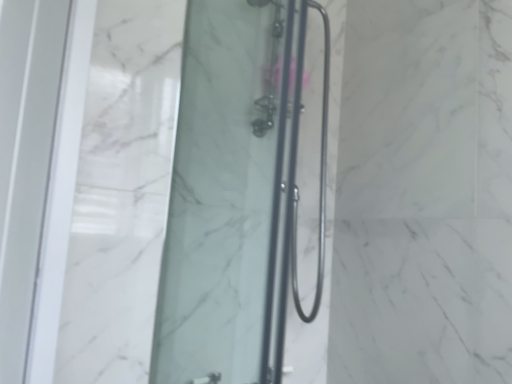
In the scene shown: How much space does transparent glass shower door at center, positioned as the second shower door in back-to-front order, occupy vertically?

transparent glass shower door at center, positioned as the second shower door in back-to-front order, is 3.73 feet in height.

Find the location of a particular element. The height and width of the screenshot is (384, 512). transparent glass shower door at center, the first shower door viewed from the front is located at coordinates (236, 194).

Describe the element at coordinates (236, 194) in the screenshot. This screenshot has width=512, height=384. I see `transparent glass shower door at center, which appears as the 2th shower door when viewed from the right` at that location.

What do you see at coordinates (320, 186) in the screenshot?
I see `black metal shower door at center, the 1th shower door when ordered from right to left` at bounding box center [320, 186].

In order to click on black metal shower door at center, the 2th shower door when ordered from front to back in this screenshot , I will do `click(320, 186)`.

This screenshot has width=512, height=384. What are the coordinates of `transparent glass shower door at center, positioned as the second shower door in back-to-front order` in the screenshot? It's located at (236, 194).

Considering the relative positions of black metal shower door at center, the first shower door when ordered from back to front, and transparent glass shower door at center, positioned as the second shower door in back-to-front order, in the image provided, is black metal shower door at center, the first shower door when ordered from back to front, to the left of transparent glass shower door at center, positioned as the second shower door in back-to-front order, from the viewer's perspective?

In fact, black metal shower door at center, the first shower door when ordered from back to front, is to the right of transparent glass shower door at center, positioned as the second shower door in back-to-front order.

Which object is more forward, black metal shower door at center, the 2th shower door positioned from the left, or transparent glass shower door at center, which is counted as the first shower door, starting from the left?

Positioned in front is transparent glass shower door at center, which is counted as the first shower door, starting from the left.

Considering the points (318, 243) and (233, 352), which point is in front, point (318, 243) or point (233, 352)?

The point (233, 352) is closer.

From the image's perspective, relative to transparent glass shower door at center, the first shower door viewed from the front, is black metal shower door at center, the 2th shower door positioned from the left, above or below?

Clearly, from the image's perspective, black metal shower door at center, the 2th shower door positioned from the left, is above transparent glass shower door at center, the first shower door viewed from the front.

From a real-world perspective, which is physically below, black metal shower door at center, the 2th shower door when ordered from front to back, or transparent glass shower door at center, positioned as the second shower door in back-to-front order?

In real-world perspective, transparent glass shower door at center, positioned as the second shower door in back-to-front order, is lower.

Can you confirm if black metal shower door at center, the first shower door when ordered from back to front, is wider than transparent glass shower door at center, which is counted as the first shower door, starting from the left?

Yes.

Between black metal shower door at center, the first shower door when ordered from back to front, and transparent glass shower door at center, which appears as the 2th shower door when viewed from the right, which one has more height?

transparent glass shower door at center, which appears as the 2th shower door when viewed from the right.

Between black metal shower door at center, the 2th shower door positioned from the left, and transparent glass shower door at center, positioned as the second shower door in back-to-front order, which one has smaller size?

black metal shower door at center, the 2th shower door positioned from the left, is smaller.

Is black metal shower door at center, the 1th shower door when ordered from right to left, outside of transparent glass shower door at center, the first shower door viewed from the front?

black metal shower door at center, the 1th shower door when ordered from right to left, lies outside transparent glass shower door at center, the first shower door viewed from the front,'s area.

Is black metal shower door at center, the 2th shower door positioned from the left, in contact with transparent glass shower door at center, which is counted as the first shower door, starting from the left?

There is a gap between black metal shower door at center, the 2th shower door positioned from the left, and transparent glass shower door at center, which is counted as the first shower door, starting from the left.

Is black metal shower door at center, the 2th shower door when ordered from front to back, facing away from transparent glass shower door at center, which is counted as the first shower door, starting from the left?

No, black metal shower door at center, the 2th shower door when ordered from front to back, is not facing the opposite direction of transparent glass shower door at center, which is counted as the first shower door, starting from the left.

This screenshot has height=384, width=512. I want to click on shower door on the right of transparent glass shower door at center, which is counted as the first shower door, starting from the left, so click(x=320, y=186).

Can you confirm if transparent glass shower door at center, the first shower door viewed from the front, is positioned to the left of black metal shower door at center, the 1th shower door when ordered from right to left?

Yes, transparent glass shower door at center, the first shower door viewed from the front, is to the left of black metal shower door at center, the 1th shower door when ordered from right to left.

Who is more distant, transparent glass shower door at center, positioned as the second shower door in back-to-front order, or black metal shower door at center, the 2th shower door when ordered from front to back?

black metal shower door at center, the 2th shower door when ordered from front to back, is more distant.

Is point (186, 277) closer or farther from the camera than point (325, 144)?

Clearly, point (186, 277) is closer to the camera than point (325, 144).

From the image's perspective, is transparent glass shower door at center, the first shower door viewed from the front, positioned above or below black metal shower door at center, the 1th shower door when ordered from right to left?

Clearly, from the image's perspective, transparent glass shower door at center, the first shower door viewed from the front, is below black metal shower door at center, the 1th shower door when ordered from right to left.

From the picture: From a real-world perspective, is transparent glass shower door at center, positioned as the second shower door in back-to-front order, located beneath black metal shower door at center, the first shower door when ordered from back to front?

Yes, from a real-world perspective, transparent glass shower door at center, positioned as the second shower door in back-to-front order, is below black metal shower door at center, the first shower door when ordered from back to front.

Considering the sizes of objects transparent glass shower door at center, which appears as the 2th shower door when viewed from the right, and black metal shower door at center, the 1th shower door when ordered from right to left, in the image provided, who is wider, transparent glass shower door at center, which appears as the 2th shower door when viewed from the right, or black metal shower door at center, the 1th shower door when ordered from right to left,?

With larger width is black metal shower door at center, the 1th shower door when ordered from right to left.

Considering the sizes of objects transparent glass shower door at center, the first shower door viewed from the front, and black metal shower door at center, the 1th shower door when ordered from right to left, in the image provided, who is taller, transparent glass shower door at center, the first shower door viewed from the front, or black metal shower door at center, the 1th shower door when ordered from right to left,?

transparent glass shower door at center, the first shower door viewed from the front, is taller.

Is transparent glass shower door at center, the first shower door viewed from the front, bigger than black metal shower door at center, the first shower door when ordered from back to front?

Indeed, transparent glass shower door at center, the first shower door viewed from the front, has a larger size compared to black metal shower door at center, the first shower door when ordered from back to front.

Can we say transparent glass shower door at center, the first shower door viewed from the front, lies outside black metal shower door at center, the 1th shower door when ordered from right to left?

That's correct, transparent glass shower door at center, the first shower door viewed from the front, is outside of black metal shower door at center, the 1th shower door when ordered from right to left.

Are transparent glass shower door at center, which appears as the 2th shower door when viewed from the right, and black metal shower door at center, the 2th shower door positioned from the left, located far from each other?

No.

Is transparent glass shower door at center, the first shower door viewed from the front, aimed at black metal shower door at center, the 2th shower door when ordered from front to back?

No, transparent glass shower door at center, the first shower door viewed from the front, is not aimed at black metal shower door at center, the 2th shower door when ordered from front to back.

Can you tell me how much transparent glass shower door at center, which appears as the 2th shower door when viewed from the right, and black metal shower door at center, the 2th shower door when ordered from front to back, differ in facing direction?

transparent glass shower door at center, which appears as the 2th shower door when viewed from the right, and black metal shower door at center, the 2th shower door when ordered from front to back, are facing 90 degrees away from each other.

This screenshot has width=512, height=384. I want to click on shower door on the right of transparent glass shower door at center, positioned as the second shower door in back-to-front order, so click(320, 186).

There is a transparent glass shower door at center, which appears as the 2th shower door when viewed from the right. Where is `shower door above it (from a real-world perspective)`? The width and height of the screenshot is (512, 384). shower door above it (from a real-world perspective) is located at coordinates (320, 186).

Locate an element on the screen. Image resolution: width=512 pixels, height=384 pixels. shower door below the black metal shower door at center, the first shower door when ordered from back to front (from a real-world perspective) is located at coordinates (236, 194).